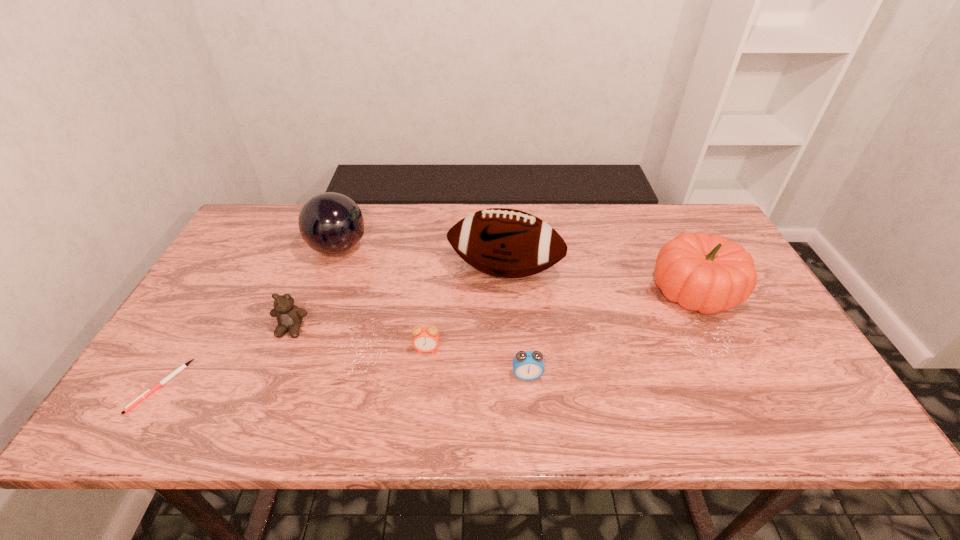
The height and width of the screenshot is (540, 960). In order to click on free point that satisfies the following two spatial constraints: 1. on the side of the bowling ball with the finger holes; 2. on the face of the teddy bear in this screenshot , I will do `click(309, 329)`.